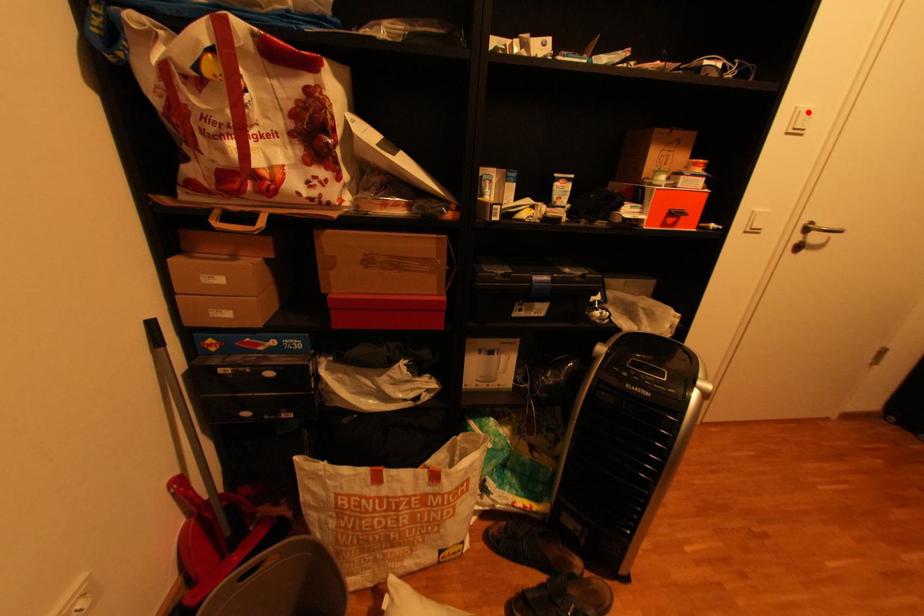
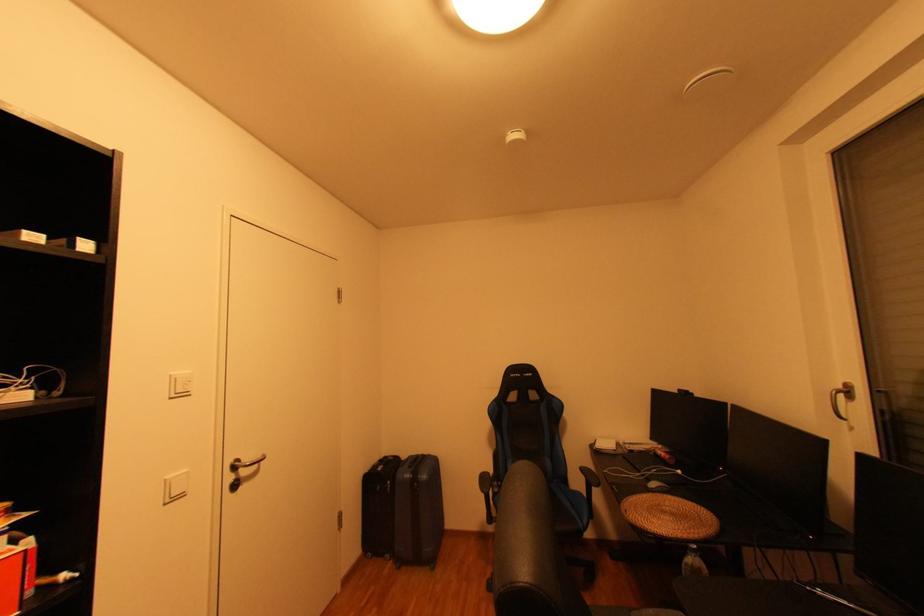
Find the pixel in the second image that matches the highlighted location in the first image.

(185, 379)